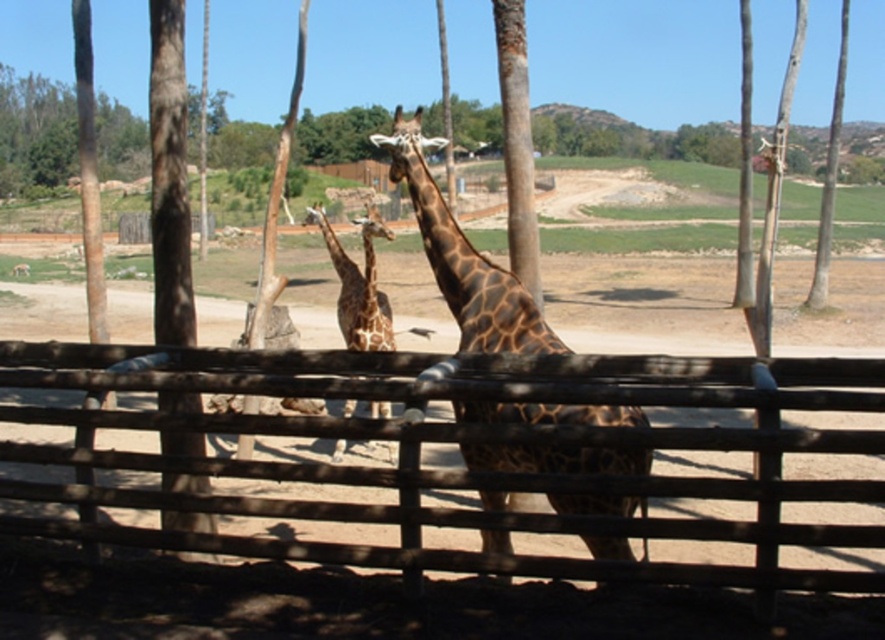
Question: Does brown wooden fence at center have a larger size compared to spotted brown giraffe at center?

Choices:
 (A) yes
 (B) no

Answer: (B)

Question: Which object appears farthest from the camera in this image?

Choices:
 (A) brown spotted giraffe at center
 (B) spotted brown giraffe at center

Answer: (A)

Question: Can you confirm if brown spotted giraffe at center is positioned to the left of spotted brown giraffe at center?

Choices:
 (A) yes
 (B) no

Answer: (B)

Question: Can you confirm if brown wooden fence at center is smaller than brown spotted giraffe at center?

Choices:
 (A) no
 (B) yes

Answer: (A)

Question: Among these objects, which one is farthest from the camera?

Choices:
 (A) brown wooden fence at center
 (B) spotted brown giraffe at center
 (C) brown spotted giraffe at center

Answer: (C)

Question: Which object is farther from the camera taking this photo?

Choices:
 (A) brown spotted giraffe at center
 (B) brown wooden fence at center

Answer: (A)